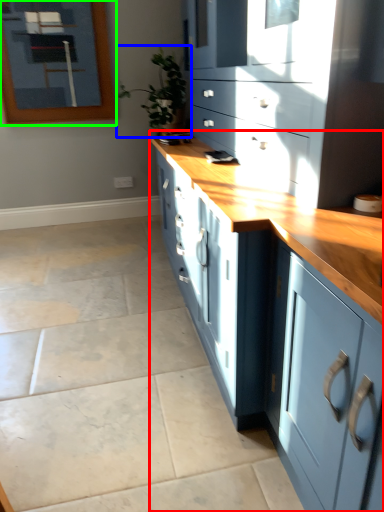
Question: Which object is positioned farthest from cabinetry (highlighted by a red box)? Select from houseplant (highlighted by a blue box) and picture frame (highlighted by a green box).

Choices:
 (A) houseplant
 (B) picture frame

Answer: (B)